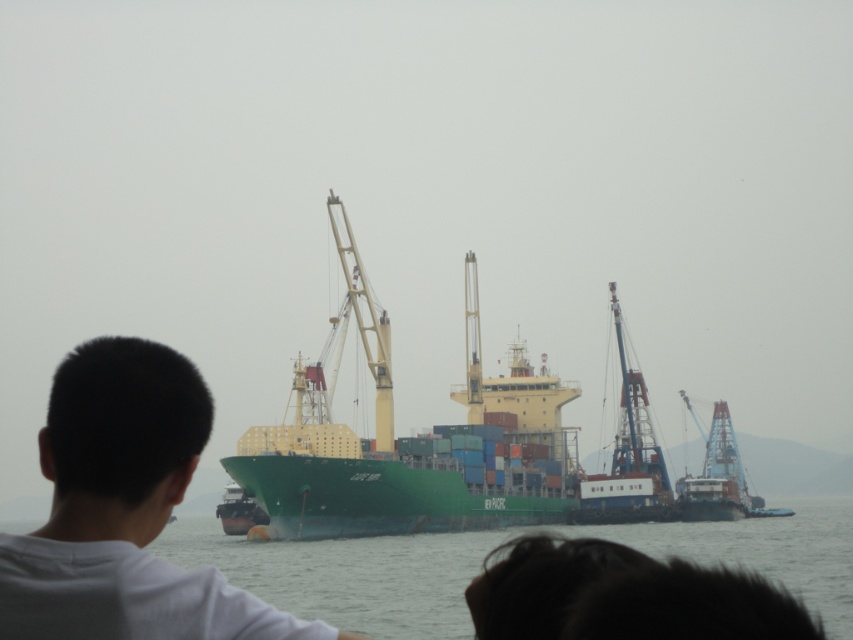
Question: Can you confirm if white matte shirt at center is positioned below green matte water at center?

Choices:
 (A) no
 (B) yes

Answer: (A)

Question: Based on their relative distances, which object is farther from the green matte water at center?

Choices:
 (A) white matte shirt at center
 (B) yellow metallic crane at center

Answer: (A)

Question: Which of the following is the closest to the observer?

Choices:
 (A) (177, 372)
 (B) (318, 544)
 (C) (343, 269)

Answer: (A)

Question: Which point appears closest to the camera in this image?

Choices:
 (A) (730, 532)
 (B) (329, 216)

Answer: (B)

Question: Can you confirm if white matte shirt at center is smaller than yellow metallic crane at center?

Choices:
 (A) yes
 (B) no

Answer: (A)

Question: Can you confirm if white matte shirt at center is positioned to the right of green matte water at center?

Choices:
 (A) yes
 (B) no

Answer: (B)